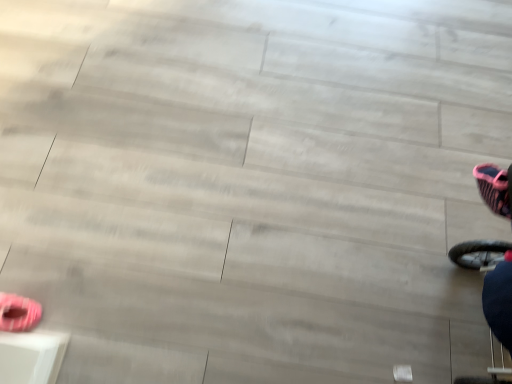
Where is `pink striped fabric shoe at lower left`? The width and height of the screenshot is (512, 384). pink striped fabric shoe at lower left is located at coordinates (18, 313).

This screenshot has height=384, width=512. Describe the element at coordinates (18, 313) in the screenshot. I see `pink striped fabric shoe at lower left` at that location.

Identify the location of pink striped fabric shoe at lower left. The width and height of the screenshot is (512, 384). (18, 313).